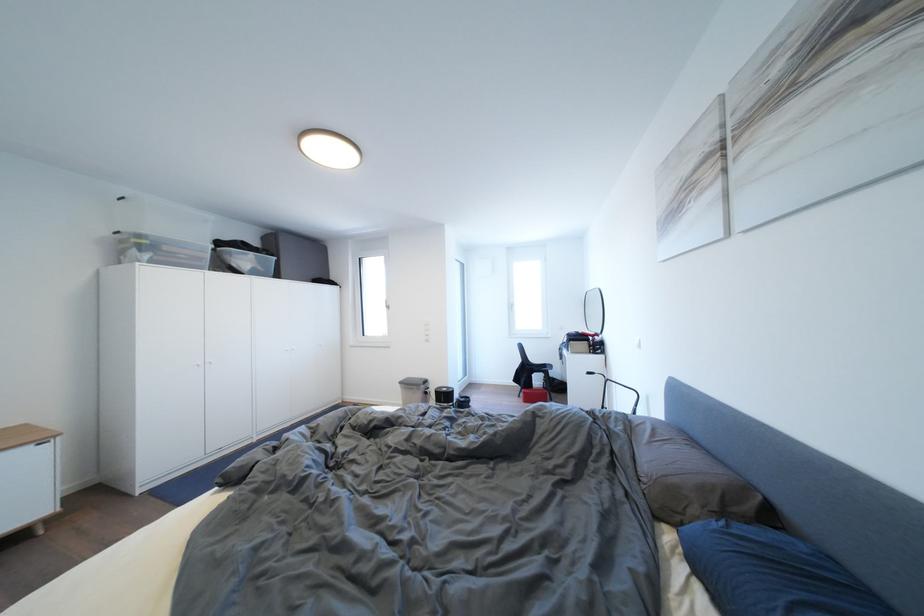
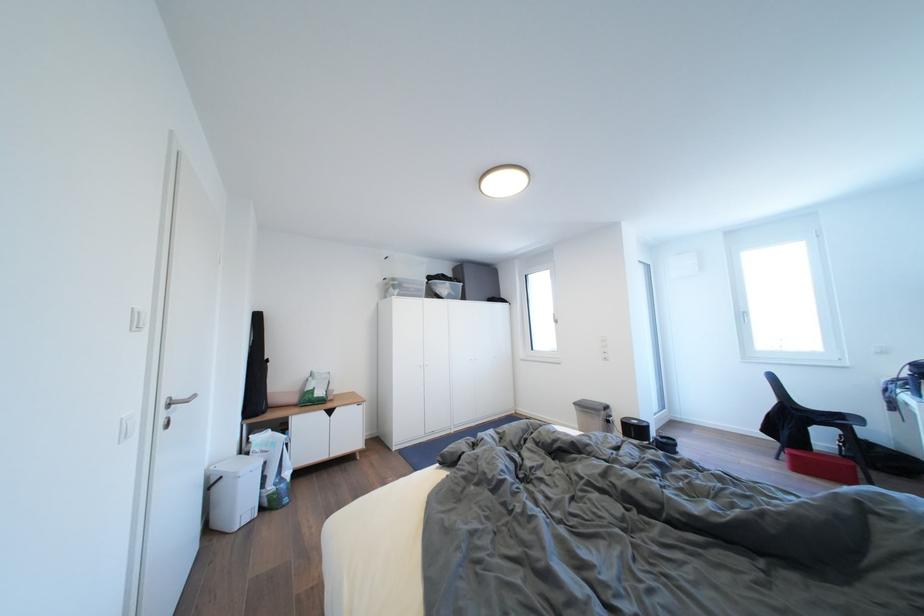
Question: The images are taken continuously from a first-person perspective. In which direction is your viewpoint rotating?

Choices:
 (A) Left
 (B) Right
 (C) Up
 (D) Down

Answer: (A)